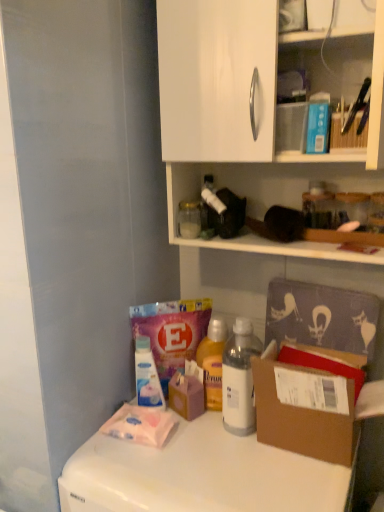
The height and width of the screenshot is (512, 384). Identify the location of brown cardboard box at lower right. (307, 402).

Measure the distance between point (x=231, y=422) and camera.

Point (x=231, y=422) is 1.07 meters away from camera.

This screenshot has height=512, width=384. Describe the element at coordinates (199, 474) in the screenshot. I see `white glossy counter top at lower left` at that location.

This screenshot has width=384, height=512. Identify the location of clear glass jar at upper center, the second bottle from the right. (189, 219).

This screenshot has width=384, height=512. I want to click on brown cardboard box at lower right, so click(x=307, y=402).

Is white plastic bottle at center, the second bottle ordered from the bottom, positioned in front of brown cardboard box at lower right?

No, white plastic bottle at center, the second bottle ordered from the bottom, is behind brown cardboard box at lower right.

From a real-world perspective, is white plastic bottle at center, the second bottle ordered from the bottom, located beneath brown cardboard box at lower right?

Actually, white plastic bottle at center, the second bottle ordered from the bottom, is physically above brown cardboard box at lower right in the real world.

Is point (237, 412) in front of point (302, 435)?

No, it is behind (302, 435).

Is white plastic bottle at center, the third bottle when ordered from left to right, with brown cardboard box at lower right?

white plastic bottle at center, the third bottle when ordered from left to right, and brown cardboard box at lower right are clearly separated.

Is white plastic bottle at center, the second bottle ordered from the bottom, oriented away from white glossy counter top at lower left?

No, white glossy counter top at lower left is not at the back of white plastic bottle at center, the second bottle ordered from the bottom.

Considering the points (248, 398) and (126, 481), which point is behind, point (248, 398) or point (126, 481)?

The point (248, 398) is more distant.

Can you confirm if white plastic bottle at center, the second bottle ordered from the bottom, is smaller than white glossy counter top at lower left?

Yes, white plastic bottle at center, the second bottle ordered from the bottom, is smaller than white glossy counter top at lower left.

From a real-world perspective, is brown cardboard box at lower right physically below white glossy counter top at lower left?

Actually, brown cardboard box at lower right is physically above white glossy counter top at lower left in the real world.

Is brown cardboard box at lower right taller or shorter than white glossy counter top at lower left?

Considering their sizes, brown cardboard box at lower right has less height than white glossy counter top at lower left.

From the image's perspective, which one is positioned higher, brown cardboard box at lower right or white glossy counter top at lower left?

From the image's view, brown cardboard box at lower right is above.

From a real-world perspective, which object rests below the other?

brown cardboard box at lower right.

Is clear glass jar at upper center, the 3th bottle when ordered from bottom to top, oriented towards brown cardboard box at lower right?

No.

Based on the photo, between clear glass jar at upper center, which is counted as the first bottle, starting from the top, and brown cardboard box at lower right, which one appears on the right side from the viewer's perspective?

From the viewer's perspective, brown cardboard box at lower right appears more on the right side.

Is clear glass jar at upper center, the second bottle from the right, further to the viewer compared to brown cardboard box at lower right?

Yes, clear glass jar at upper center, the second bottle from the right, is behind brown cardboard box at lower right.

From a real-world perspective, does clear glass jar at upper center, the 3th bottle when ordered from bottom to top, stand above transparent plastic bottle at lower center, the 1th bottle positioned from the left?

Yes, from a real-world perspective, clear glass jar at upper center, the 3th bottle when ordered from bottom to top, is on top of transparent plastic bottle at lower center, the 1th bottle positioned from the left.

Locate an element on the screen. This screenshot has height=512, width=384. the 1st bottle counting from the right side of the transparent plastic bottle at lower center, acting as the first bottle starting from the bottom is located at coordinates (189, 219).

From the picture: Which of these two, clear glass jar at upper center, which is counted as the first bottle, starting from the top, or transparent plastic bottle at lower center, arranged as the third bottle when viewed from the top, is wider?

With larger width is transparent plastic bottle at lower center, arranged as the third bottle when viewed from the top.

Does clear glass jar at upper center, the second bottle from the right, come behind white glossy counter top at lower left?

Yes, clear glass jar at upper center, the second bottle from the right, is further from the camera.

Is point (182, 221) behind point (84, 492)?

Yes, point (182, 221) is behind point (84, 492).

Is clear glass jar at upper center, acting as the second bottle starting from the left, turned away from white glossy counter top at lower left?

No.

Is white plastic bottle at center, arranged as the 1th bottle when viewed from the right, located within clear glass jar at upper center, which is counted as the first bottle, starting from the top?

Actually, white plastic bottle at center, arranged as the 1th bottle when viewed from the right, is outside clear glass jar at upper center, which is counted as the first bottle, starting from the top.

Is clear glass jar at upper center, the 3th bottle when ordered from bottom to top, positioned far away from white plastic bottle at center, which ranks as the second bottle in top-to-bottom order?

Actually, clear glass jar at upper center, the 3th bottle when ordered from bottom to top, and white plastic bottle at center, which ranks as the second bottle in top-to-bottom order, are a little close together.

Which of these two, clear glass jar at upper center, which is counted as the first bottle, starting from the top, or white plastic bottle at center, the third bottle when ordered from left to right, is bigger?

white plastic bottle at center, the third bottle when ordered from left to right.

This screenshot has width=384, height=512. What are the coordinates of `bottle to the right of clear glass jar at upper center, acting as the second bottle starting from the left` in the screenshot? It's located at tap(239, 379).

From the image's perspective, starting from the brown cardboard box at lower right, which bottle is the 2nd one above? Please provide its 2D coordinates.

[(239, 379)]

Find the location of `counter top lying in front of the white plastic bottle at center, the third bottle when ordered from left to right`. counter top lying in front of the white plastic bottle at center, the third bottle when ordered from left to right is located at coordinates (199, 474).

Looking at this image, looking at the image, which one is located closer to clear glass jar at upper center, the second bottle from the right, transparent plastic bottle at lower center, arranged as the third bottle when viewed from the top, or white glossy counter top at lower left?

transparent plastic bottle at lower center, arranged as the third bottle when viewed from the top, lies closer to clear glass jar at upper center, the second bottle from the right, than the other object.

Considering their positions, is clear glass jar at upper center, acting as the second bottle starting from the left, positioned closer to white glossy counter top at lower left than white plastic bottle at center, the second bottle ordered from the bottom?

white plastic bottle at center, the second bottle ordered from the bottom, is closer to white glossy counter top at lower left.

Which object lies further to the anchor point brown cardboard box at lower right, white plastic bottle at center, the second bottle ordered from the bottom, or clear glass jar at upper center, which is counted as the first bottle, starting from the top?

clear glass jar at upper center, which is counted as the first bottle, starting from the top, is further to brown cardboard box at lower right.

Considering their positions, is transparent plastic bottle at lower center, the 1th bottle positioned from the left, positioned further to white glossy counter top at lower left than white plastic bottle at center, the second bottle ordered from the bottom?

transparent plastic bottle at lower center, the 1th bottle positioned from the left, is further to white glossy counter top at lower left.

From the image, which object appears to be nearer to brown cardboard box at lower right, transparent plastic bottle at lower center, arranged as the third bottle when viewed from the top, or white plastic bottle at center, the second bottle ordered from the bottom?

Based on the image, white plastic bottle at center, the second bottle ordered from the bottom, appears to be nearer to brown cardboard box at lower right.

Based on their spatial positions, is white plastic bottle at center, which ranks as the second bottle in top-to-bottom order, or brown cardboard box at lower right closer to transparent plastic bottle at lower center, arranged as the third bottle when viewed from the top?

white plastic bottle at center, which ranks as the second bottle in top-to-bottom order.

Based on the photo, looking at the image, which one is located further to transparent plastic bottle at lower center, the 3th bottle in the right-to-left sequence, clear glass jar at upper center, acting as the second bottle starting from the left, or white glossy counter top at lower left?

clear glass jar at upper center, acting as the second bottle starting from the left, is further to transparent plastic bottle at lower center, the 3th bottle in the right-to-left sequence.

Based on their spatial positions, is clear glass jar at upper center, which is counted as the first bottle, starting from the top, or transparent plastic bottle at lower center, acting as the first bottle starting from the bottom, further from brown cardboard box at lower right?

clear glass jar at upper center, which is counted as the first bottle, starting from the top.

Locate an element on the screen. bottle between white plastic bottle at center, which ranks as the second bottle in top-to-bottom order, and white glossy counter top at lower left in the up-down direction is located at coordinates (147, 376).

Find the location of a particular element. Image resolution: width=384 pixels, height=512 pixels. cardboard box between transparent plastic bottle at lower center, the 1th bottle positioned from the left, and white glossy counter top at lower left in the up-down direction is located at coordinates (307, 402).

You are a GUI agent. You are given a task and a screenshot of the screen. Output one action in this format:
    pyautogui.click(x=<x>, y=<y>)
    Task: Click on the bottle that lies between clear glass jar at upper center, the second bottle from the right, and transparent plastic bottle at lower center, arranged as the third bottle when viewed from the top, from top to bottom
    The image size is (384, 512).
    Given the screenshot: What is the action you would take?
    pyautogui.click(x=239, y=379)

The width and height of the screenshot is (384, 512). Identify the location of cardboard box between white plastic bottle at center, which ranks as the second bottle in top-to-bottom order, and white glossy counter top at lower left, in the vertical direction. (307, 402).